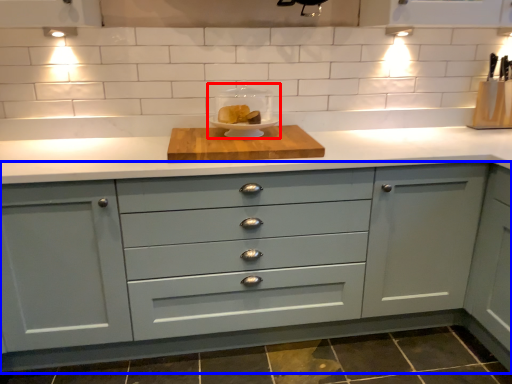
Question: Which object is further to the camera taking this photo, appliance (highlighted by a red box) or cabinetry (highlighted by a blue box)?

Choices:
 (A) appliance
 (B) cabinetry

Answer: (A)